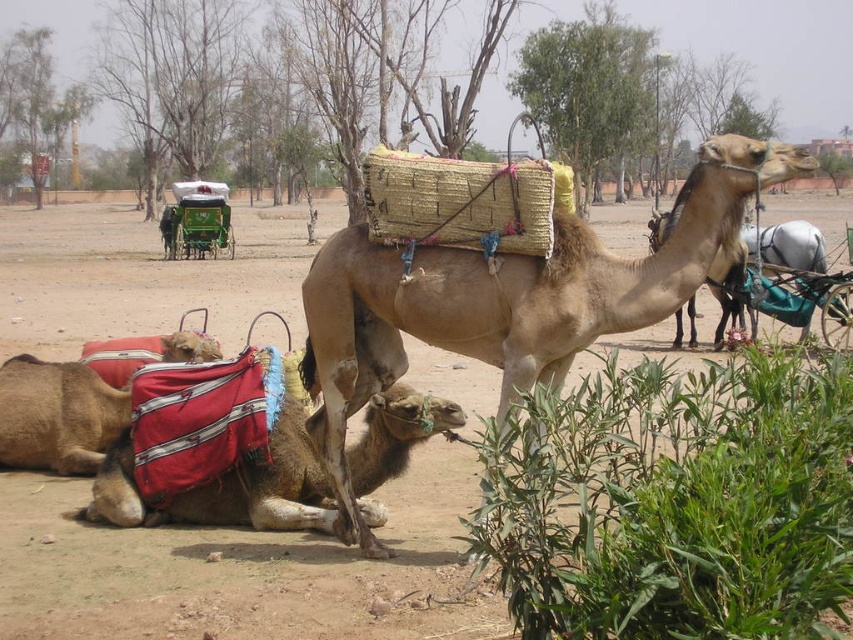
In the scene shown: You are planning to cross the brown dirt field at center with a cart that is as wide as the light brown camel at center. Based on the scene, will the cart fit through the field?

The brown dirt field at center is wider than the light brown camel at center, so the cart, which is as wide as the camel, will fit through the field.

You are a photographer standing in the desert scene. You want to capture a photo of the camels and the basket. There is a point at coordinates point (422, 452) that is 6.71 meters away from you. If you move 3 meters closer to this point, will you be within 4 meters of the camels and the basket?

Moving 3 meters closer to the point at (422, 452) would bring you to 3.71 meters from that point. Since the camels and basket are part of the scene at this point, you would be within 4 meters of them.

You are a traveler in the desert and want to find the red fabric camel at lower left. Which direction should you move from the light brown camel at center to locate it?

The light brown camel at center is to the right of the red fabric camel at lower left, so you should move to the left from the light brown camel at center to find the red fabric camel at lower left.